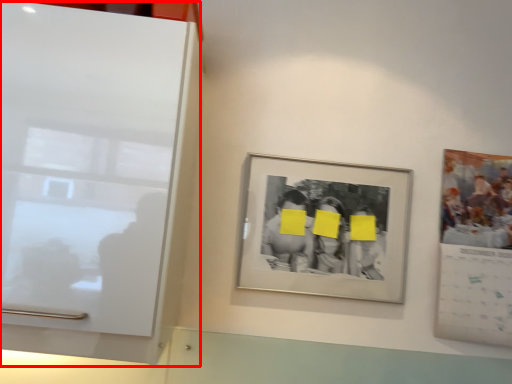
Question: From the image's perspective, what is the correct spatial positioning of glass door (annotated by the red box) in reference to picture frame?

Choices:
 (A) above
 (B) below

Answer: (A)